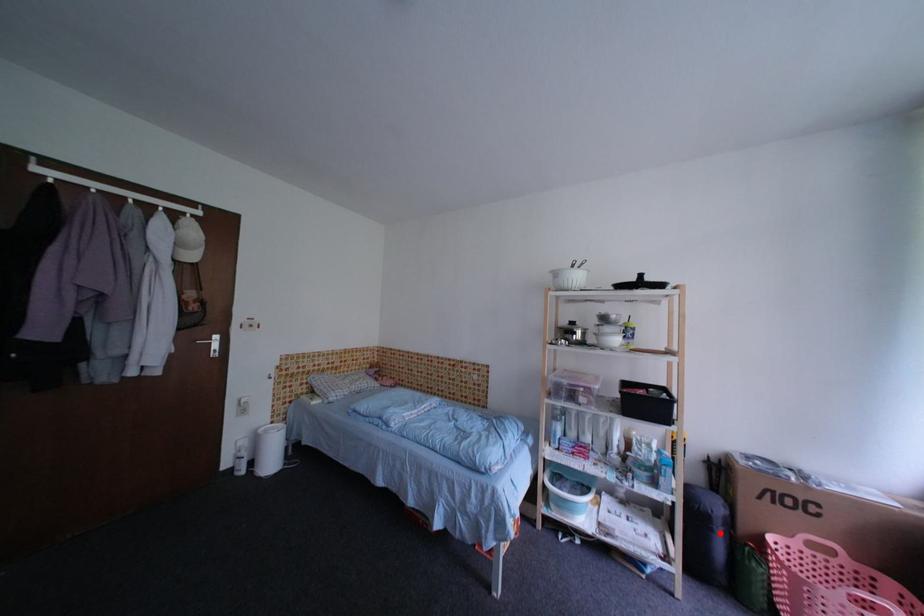
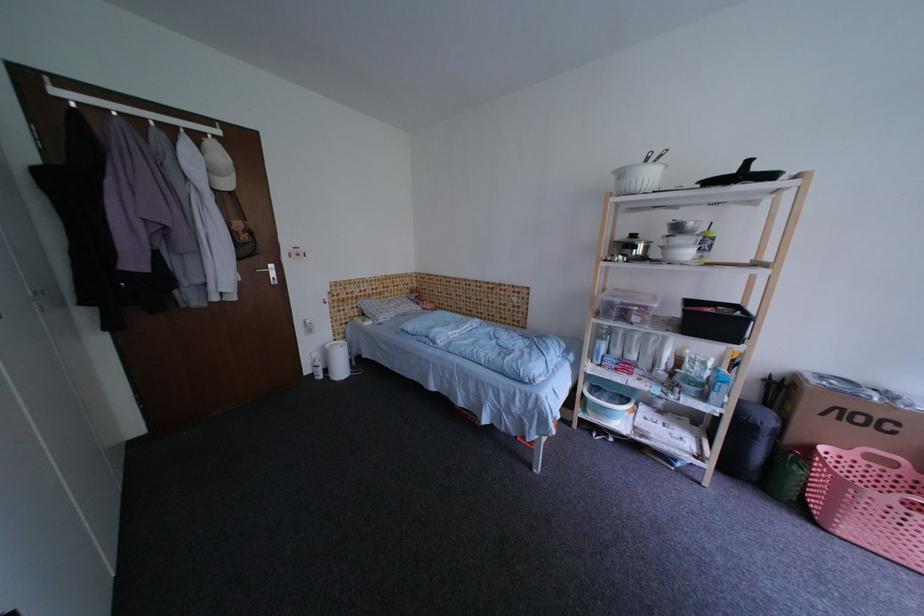
The point at the highlighted location is marked in the first image. Where is the corresponding point in the second image?

(764, 440)